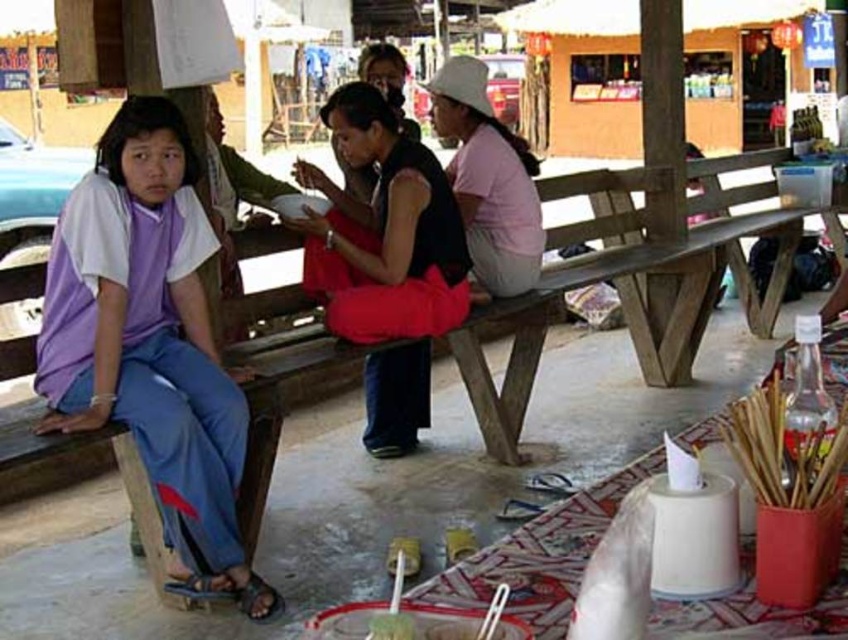
Question: Can you confirm if purple cotton shirt at left is positioned below black matte shirt at center?

Choices:
 (A) no
 (B) yes

Answer: (B)

Question: Which point is closer to the camera?

Choices:
 (A) (121, 355)
 (B) (467, 90)
 (C) (378, 58)

Answer: (A)

Question: Which of the following is the farthest from the observer?

Choices:
 (A) black matte dress at center
 (B) purple cotton shirt at left
 (C) black matte shirt at center
 (D) pink cotton shirt at center

Answer: (D)

Question: Which is farther from the pink cotton shirt at center?

Choices:
 (A) black matte shirt at center
 (B) black matte dress at center

Answer: (A)

Question: Where is black matte dress at center located in relation to pink cotton shirt at center in the image?

Choices:
 (A) below
 (B) above

Answer: (A)

Question: Can you confirm if purple cotton shirt at left is positioned below black matte shirt at center?

Choices:
 (A) yes
 (B) no

Answer: (A)